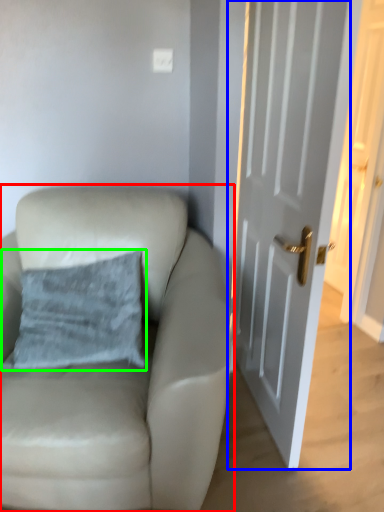
Question: Which is farther away from chair (highlighted by a red box)? door (highlighted by a blue box) or pillow (highlighted by a green box)?

Choices:
 (A) door
 (B) pillow

Answer: (A)